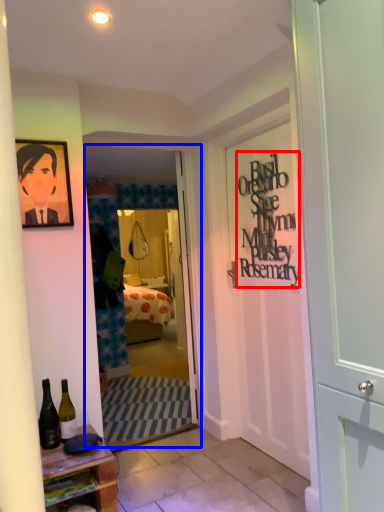
Question: Which of the following is the closest to the observer, writing (highlighted by a red box) or screen door (highlighted by a blue box)?

Choices:
 (A) writing
 (B) screen door

Answer: (A)